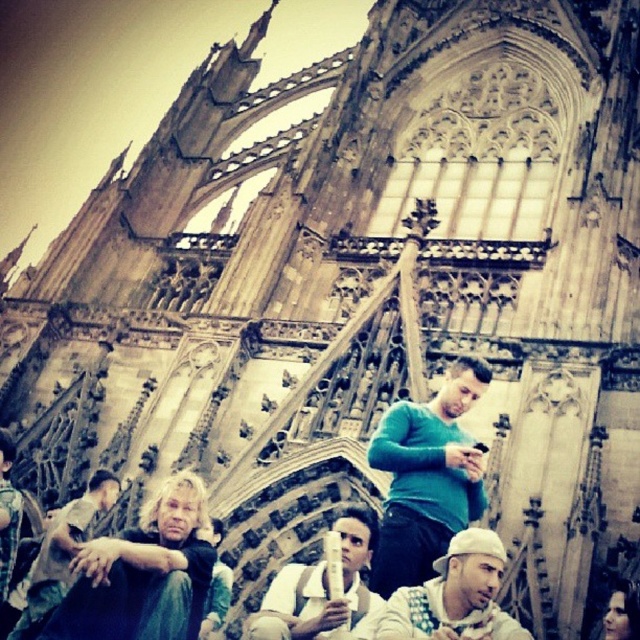
You are a photographer trying to capture a group photo of the blonde hair man at lower left and the green matte sweater at center. Since you want both subjects to be in focus, you need to adjust your camera settings. Which subject should you focus on to ensure the other is also in focus, considering their heights?

The blonde hair man at lower left is not as tall as green matte sweater at center, so focusing on the taller subject, green matte sweater at center, will help ensure both are in focus.